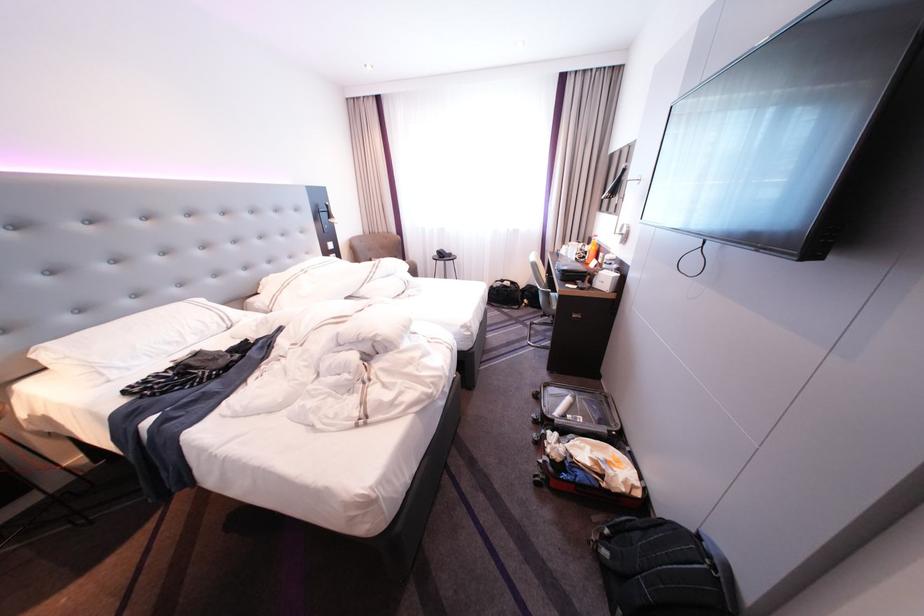
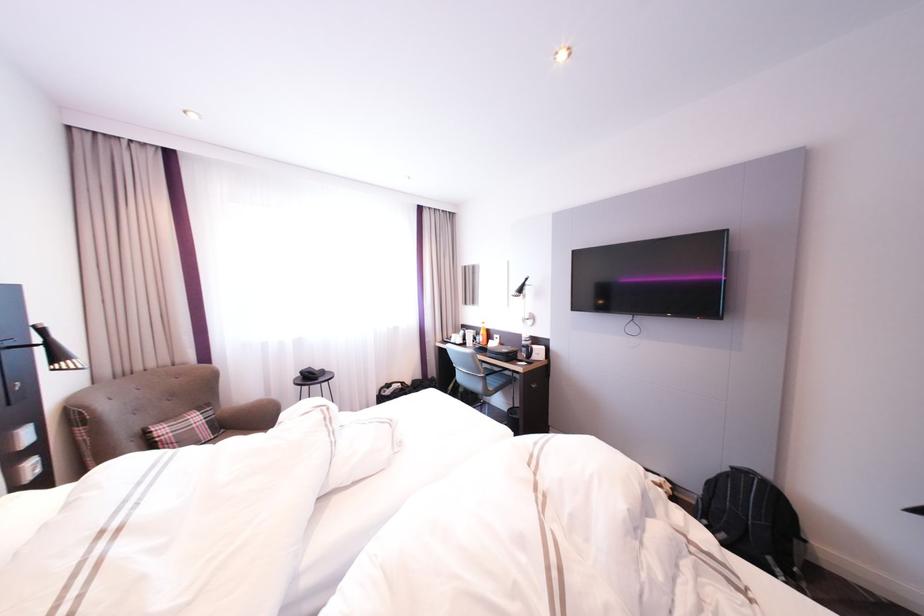
The point at (552,286) is marked in the first image. Where is the corresponding point in the second image?

(492, 373)